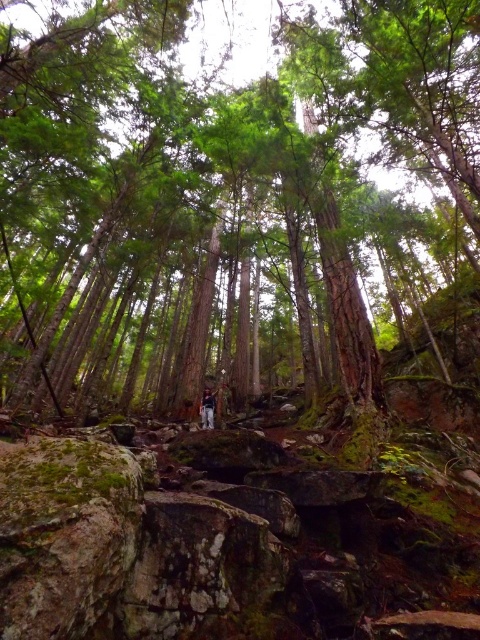
Is point (338, 97) closer to camera compared to point (205, 419)?

No, (338, 97) is further to viewer.

Between green rough bark tree at center and dark blue jeans at center, which one appears on the right side from the viewer's perspective?

green rough bark tree at center

Locate an element on the screen. green rough bark tree at center is located at coordinates (223, 195).